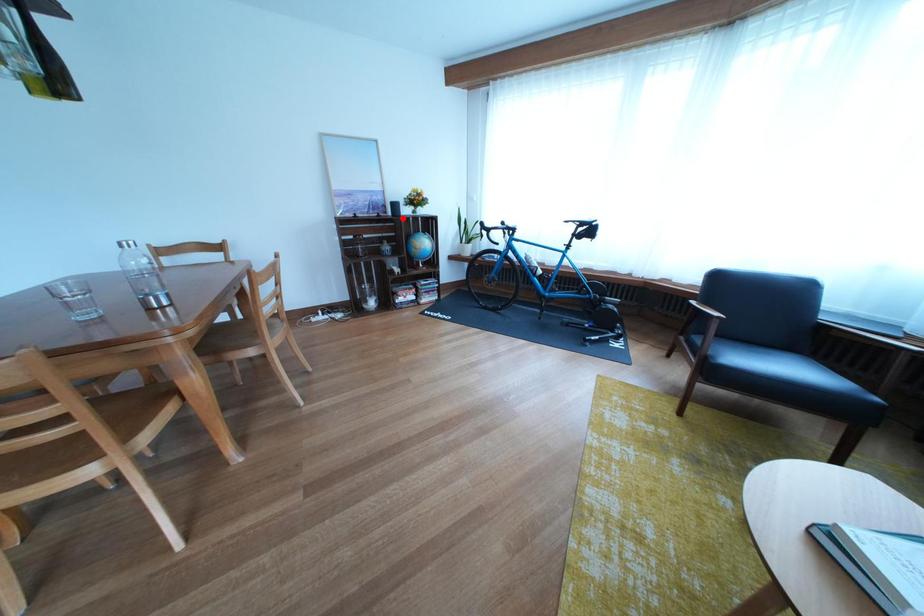
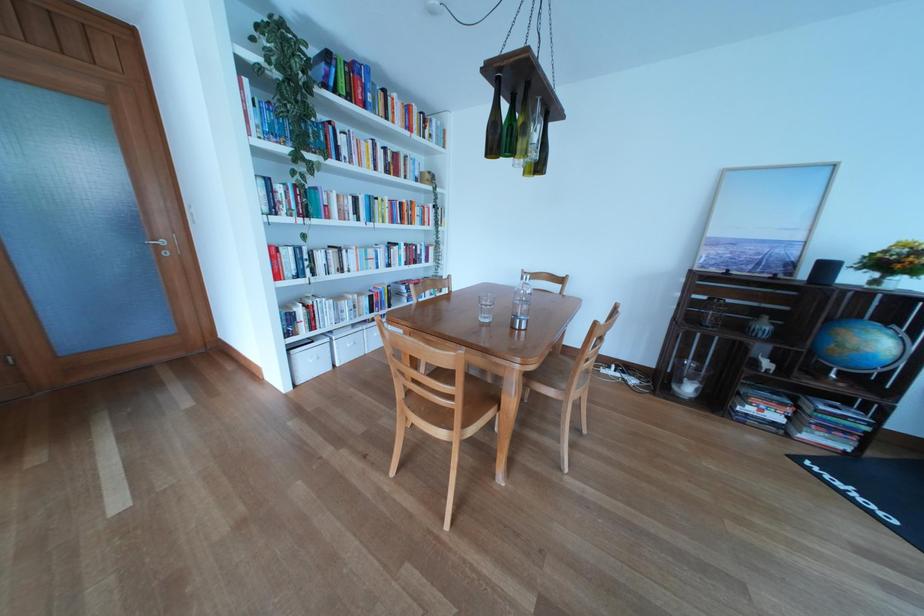
In the second image, find the point that corresponds to the highlighted location in the first image.

(816, 282)